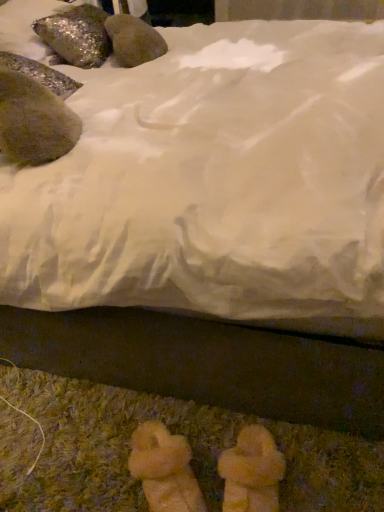
Question: Is shiny metallic rock at left, arranged as the 2th animal when viewed from the back, shorter than shiny metallic rock at upper left, which is the first animal in back-to-front order?

Choices:
 (A) yes
 (B) no

Answer: (A)

Question: Is shiny metallic rock at left, placed as the 1th animal when sorted from bottom to top, far from shiny metallic rock at upper left, placed as the 2th animal when sorted from bottom to top?

Choices:
 (A) yes
 (B) no

Answer: (B)

Question: Is shiny metallic rock at left, arranged as the 1th animal when viewed from the front, in contact with shiny metallic rock at upper left, which is the first animal in back-to-front order?

Choices:
 (A) yes
 (B) no

Answer: (B)

Question: Is shiny metallic rock at left, arranged as the 2th animal when viewed from the back, taller than shiny metallic rock at upper left, placed as the 2th animal when sorted from bottom to top?

Choices:
 (A) no
 (B) yes

Answer: (A)

Question: Does shiny metallic rock at left, placed as the 1th animal when sorted from bottom to top, lie in front of shiny metallic rock at upper left, positioned as the 1th animal in top-to-bottom order?

Choices:
 (A) no
 (B) yes

Answer: (B)

Question: From a real-world perspective, is shiny metallic rock at left, arranged as the 2th animal when viewed from the back, positioned over shiny metallic rock at upper left, marked as the 2th animal in a front-to-back arrangement, based on gravity?

Choices:
 (A) no
 (B) yes

Answer: (A)

Question: From the image's perspective, is shiny metallic rock at upper left, which is the first animal in back-to-front order, over shiny metallic rock at left, arranged as the 2th animal when viewed from the back?

Choices:
 (A) no
 (B) yes

Answer: (B)

Question: From the image's perspective, is shiny metallic rock at upper left, which is the first animal in back-to-front order, below shiny metallic rock at left, placed as the 1th animal when sorted from bottom to top?

Choices:
 (A) yes
 (B) no

Answer: (B)

Question: Is the position of shiny metallic rock at upper left, positioned as the 1th animal in top-to-bottom order, less distant than that of shiny metallic rock at left, placed as the 1th animal when sorted from bottom to top?

Choices:
 (A) yes
 (B) no

Answer: (B)

Question: Considering the relative positions of shiny metallic rock at upper left, positioned as the 1th animal in top-to-bottom order, and shiny metallic rock at left, placed as the 1th animal when sorted from bottom to top, in the image provided, is shiny metallic rock at upper left, positioned as the 1th animal in top-to-bottom order, to the left of shiny metallic rock at left, placed as the 1th animal when sorted from bottom to top, from the viewer's perspective?

Choices:
 (A) no
 (B) yes

Answer: (B)

Question: Can you confirm if shiny metallic rock at upper left, which is the first animal in back-to-front order, is thinner than shiny metallic rock at left, placed as the 1th animal when sorted from bottom to top?

Choices:
 (A) no
 (B) yes

Answer: (A)

Question: Could you tell me if shiny metallic rock at upper left, positioned as the 1th animal in top-to-bottom order, is facing shiny metallic rock at left, placed as the 1th animal when sorted from bottom to top?

Choices:
 (A) no
 (B) yes

Answer: (A)

Question: Looking at their shapes, would you say shiny metallic rock at left, arranged as the 1th animal when viewed from the front, is wider or thinner than shiny metallic rock at upper left, positioned as the 1th animal in top-to-bottom order?

Choices:
 (A) thin
 (B) wide

Answer: (A)